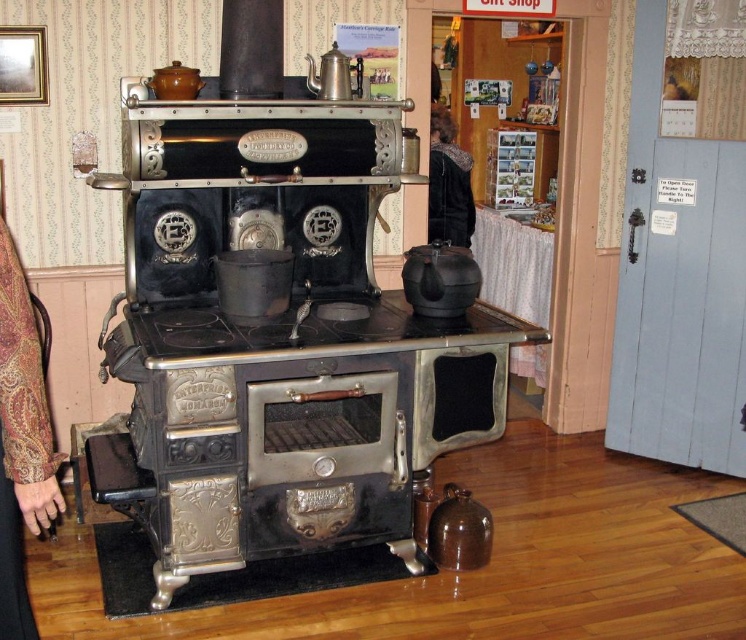
Does black cast iron stove at center have a smaller size compared to velvet black coat at center?

Incorrect, black cast iron stove at center is not smaller in size than velvet black coat at center.

Can you confirm if black cast iron stove at center is wider than velvet black coat at center?

Yes.

Measure the distance between black cast iron stove at center and camera.

7.49 feet

The image size is (746, 640). Identify the location of black cast iron stove at center. (280, 339).